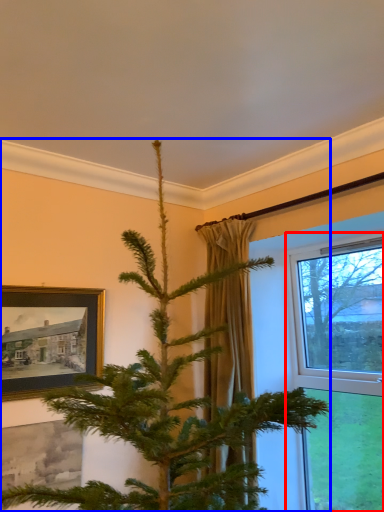
Question: Which of the following is the farthest to the observer, window (highlighted by a red box) or christmas tree (highlighted by a blue box)?

Choices:
 (A) window
 (B) christmas tree

Answer: (A)